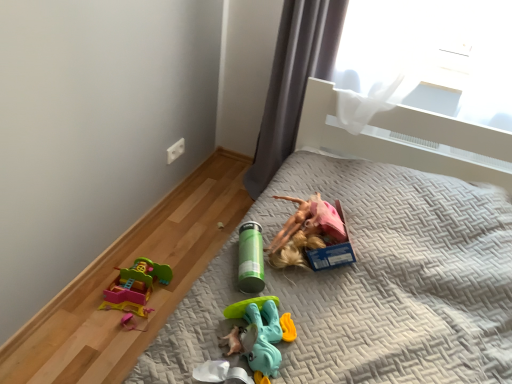
This screenshot has height=384, width=512. What are the coordinates of `green matte thermos at center, arranged as the first toy when viewed from the top` in the screenshot? It's located at (250, 258).

Locate an element on the screen. This screenshot has height=384, width=512. gray quilted bed at center is located at coordinates (400, 250).

Measure the distance between translucent plastic toy at center, which ranks as the first toy in front-to-back order, and camera.

1.03 meters.

Image resolution: width=512 pixels, height=384 pixels. What do you see at coordinates (294, 80) in the screenshot? I see `gray fabric curtain at upper right` at bounding box center [294, 80].

The image size is (512, 384). Find the location of `green matte thermos at center, the second toy when ordered from front to back`. green matte thermos at center, the second toy when ordered from front to back is located at coordinates [250, 258].

Find the location of a particular element. The image size is (512, 384). toy that is the 2nd object above the gray quilted bed at center (from a real-world perspective) is located at coordinates (250, 258).

Is gray quilted bed at center behind green matte thermos at center, which is counted as the 2th toy, starting from the bottom?

No, it is not.

In terms of size, does gray quilted bed at center appear bigger or smaller than green matte thermos at center, arranged as the first toy when viewed from the top?

Clearly, gray quilted bed at center is larger in size than green matte thermos at center, arranged as the first toy when viewed from the top.

In terms of width, does gray fabric curtain at upper right look wider or thinner when compared to green matte thermos at center, the first toy viewed from the back?

Considering their sizes, gray fabric curtain at upper right looks broader than green matte thermos at center, the first toy viewed from the back.

Choose the correct answer: Is gray fabric curtain at upper right inside green matte thermos at center, which is counted as the 2th toy, starting from the bottom, or outside it?

gray fabric curtain at upper right is spatially situated outside green matte thermos at center, which is counted as the 2th toy, starting from the bottom.

Based on the photo, could you tell me if gray fabric curtain at upper right is turned towards green matte thermos at center, the first toy viewed from the back?

Yes, gray fabric curtain at upper right faces towards green matte thermos at center, the first toy viewed from the back.

The width and height of the screenshot is (512, 384). Identify the location of the 1st toy located beneath the gray fabric curtain at upper right (from a real-world perspective). (250, 258).

Is translucent plastic toy at center, which ranks as the first toy in front-to-back order, completely or partially inside green matte thermos at center, the second toy when ordered from front to back?

No, translucent plastic toy at center, which ranks as the first toy in front-to-back order, is not a part of green matte thermos at center, the second toy when ordered from front to back.

Considering the relative sizes of green matte thermos at center, the first toy viewed from the back, and translucent plastic toy at center, placed as the 2th toy when sorted from back to front, in the image provided, is green matte thermos at center, the first toy viewed from the back, shorter than translucent plastic toy at center, placed as the 2th toy when sorted from back to front,?

Incorrect, the height of green matte thermos at center, the first toy viewed from the back, does not fall short of that of translucent plastic toy at center, placed as the 2th toy when sorted from back to front.

Can you tell me how much green matte thermos at center, which is counted as the 2th toy, starting from the bottom, and translucent plastic toy at center, which ranks as the first toy in front-to-back order, differ in facing direction?

There is a 42-degree angle between the facing directions of green matte thermos at center, which is counted as the 2th toy, starting from the bottom, and translucent plastic toy at center, which ranks as the first toy in front-to-back order.

Identify the location of toy behind the translucent plastic toy at center, acting as the second toy starting from the top. (250, 258).

From the picture: Is green matte thermos at center, the second toy when ordered from front to back, aimed at gray fabric curtain at upper right?

No, green matte thermos at center, the second toy when ordered from front to back, is not facing towards gray fabric curtain at upper right.

Which is less distant, (257, 233) or (324, 60)?

Clearly, point (257, 233) is closer to the camera than point (324, 60).

In order to click on curtain on the right of green matte thermos at center, which is counted as the 2th toy, starting from the bottom in this screenshot , I will do `click(294, 80)`.

Who is taller, translucent plastic toy at center, which ranks as the first toy in front-to-back order, or gray quilted bed at center?

gray quilted bed at center is taller.

Is translucent plastic toy at center, acting as the first toy starting from the bottom, aimed at gray quilted bed at center?

Yes, translucent plastic toy at center, acting as the first toy starting from the bottom, is facing gray quilted bed at center.

Is point (227, 339) closer to camera compared to point (270, 233)?

That is True.

From the image's perspective, which one is positioned higher, green matte thermos at center, the second toy when ordered from front to back, or gray quilted bed at center?

From the image's view, green matte thermos at center, the second toy when ordered from front to back, is above.

Which is behind, point (246, 261) or point (377, 340)?

Positioned behind is point (246, 261).

From a real-world perspective, is green matte thermos at center, the first toy viewed from the back, positioned above or below gray quilted bed at center?

In terms of real-world spatial position, green matte thermos at center, the first toy viewed from the back, is above gray quilted bed at center.

Is gray quilted bed at center far away from gray fabric curtain at upper right?

That's not correct — gray quilted bed at center is a little close to gray fabric curtain at upper right.

From the image's perspective, is gray quilted bed at center over gray fabric curtain at upper right?

Incorrect, from the image's perspective, gray quilted bed at center is lower than gray fabric curtain at upper right.

From a real-world perspective, which object rests below the other?

In real-world perspective, gray quilted bed at center is lower.

Considering the points (172, 349) and (284, 24), which point is in front, point (172, 349) or point (284, 24)?

Positioned in front is point (172, 349).

I want to click on bed in front of the green matte thermos at center, which is counted as the 2th toy, starting from the bottom, so click(400, 250).

Find the location of a particular element. The height and width of the screenshot is (384, 512). curtain on the right of green matte thermos at center, the second toy when ordered from front to back is located at coordinates (294, 80).

Which object lies nearer to the anchor point translucent plastic toy at center, which ranks as the first toy in front-to-back order, gray fabric curtain at upper right or green matte thermos at center, the second toy when ordered from front to back?

green matte thermos at center, the second toy when ordered from front to back.

When comparing their distances from gray quilted bed at center, does translucent plastic toy at center, acting as the first toy starting from the bottom, or gray fabric curtain at upper right seem closer?

The object closer to gray quilted bed at center is gray fabric curtain at upper right.

From the image, which object appears to be nearer to gray quilted bed at center, green matte thermos at center, the second toy when ordered from front to back, or gray fabric curtain at upper right?

Based on the image, green matte thermos at center, the second toy when ordered from front to back, appears to be nearer to gray quilted bed at center.

Consider the image. Which object lies further to the anchor point green matte thermos at center, the second toy when ordered from front to back, gray quilted bed at center or translucent plastic toy at center, placed as the 2th toy when sorted from back to front?

gray quilted bed at center is further to green matte thermos at center, the second toy when ordered from front to back.

Which object lies nearer to the anchor point gray fabric curtain at upper right, gray quilted bed at center or translucent plastic toy at center, acting as the first toy starting from the bottom?

Among the two, gray quilted bed at center is located nearer to gray fabric curtain at upper right.

Looking at the image, which one is located further to gray fabric curtain at upper right, translucent plastic toy at center, placed as the 2th toy when sorted from back to front, or green matte thermos at center, arranged as the first toy when viewed from the top?

translucent plastic toy at center, placed as the 2th toy when sorted from back to front, is further to gray fabric curtain at upper right.

Looking at the image, which one is located closer to gray quilted bed at center, translucent plastic toy at center, acting as the second toy starting from the top, or green matte thermos at center, the first toy viewed from the back?

green matte thermos at center, the first toy viewed from the back, is positioned closer to the anchor gray quilted bed at center.

Looking at the image, which one is located closer to green matte thermos at center, which is counted as the 2th toy, starting from the bottom, gray fabric curtain at upper right or gray quilted bed at center?

The object closer to green matte thermos at center, which is counted as the 2th toy, starting from the bottom, is gray quilted bed at center.

You are a GUI agent. You are given a task and a screenshot of the screen. Output one action in this format:
    pyautogui.click(x=<x>, y=<y>)
    Task: Click on the toy between gray fabric curtain at upper right and translucent plastic toy at center, acting as the first toy starting from the bottom, in the up-down direction
    
    Given the screenshot: What is the action you would take?
    pyautogui.click(x=250, y=258)

You are a GUI agent. You are given a task and a screenshot of the screen. Output one action in this format:
    pyautogui.click(x=<x>, y=<y>)
    Task: Click on the toy between gray quilted bed at center and green matte thermos at center, which is counted as the 2th toy, starting from the bottom, along the z-axis
    This screenshot has width=512, height=384.
    Given the screenshot: What is the action you would take?
    pyautogui.click(x=232, y=341)